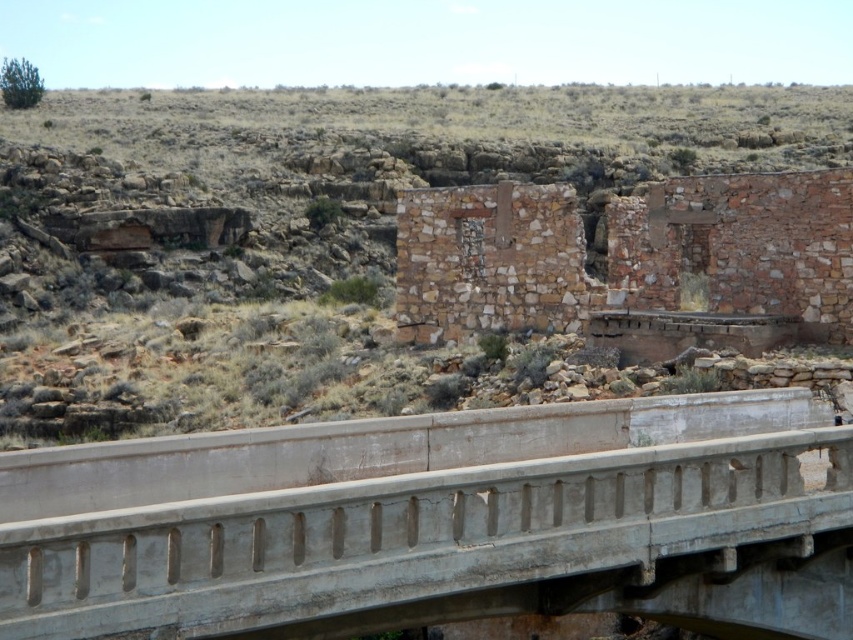
Is concrete bridge at center to the left of brown stone ruins at center from the viewer's perspective?

Yes, concrete bridge at center is to the left of brown stone ruins at center.

Which of these two, concrete bridge at center or brown stone ruins at center, stands shorter?

Standing shorter between the two is concrete bridge at center.

Between point (106, 474) and point (422, 202), which one is positioned behind?

Positioned behind is point (422, 202).

At what (x,y) coordinates should I click in order to perform the action: click on concrete bridge at center. Please return your answer as a coordinate pair (x, y). The height and width of the screenshot is (640, 853). Looking at the image, I should click on (437, 524).